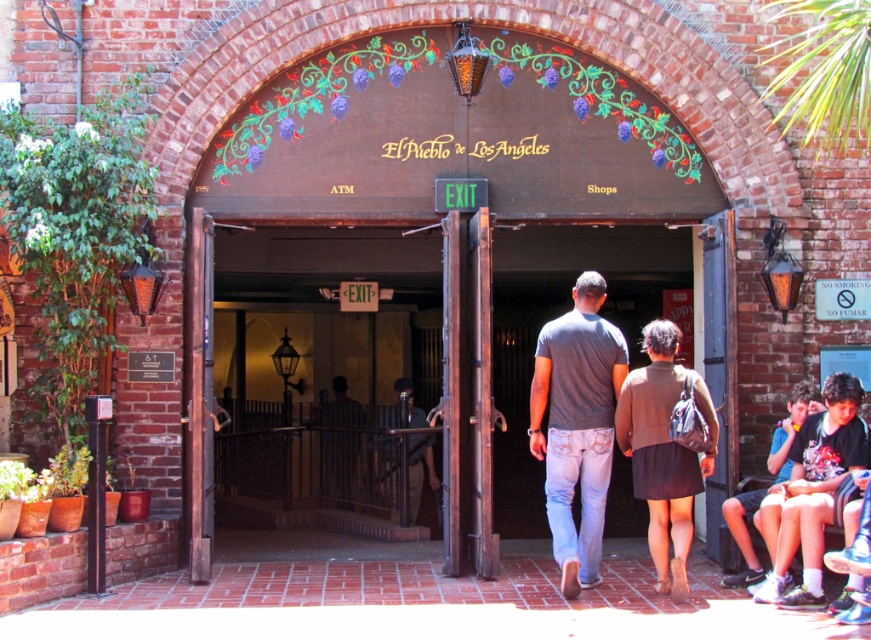
Can you confirm if dark brown sweater at center is positioned to the right of blue denim shorts at lower right?

No, dark brown sweater at center is not to the right of blue denim shorts at lower right.

Which is behind, point (636, 396) or point (728, 513)?

The point (728, 513) is more distant.

Between point (691, 481) and point (750, 497), which one is positioned in front?

Point (691, 481)

Where is `dark brown sweater at center`? The width and height of the screenshot is (871, 640). dark brown sweater at center is located at coordinates (663, 451).

Is wooden door at center thinner than blue denim shorts at lower right?

Indeed, wooden door at center has a lesser width compared to blue denim shorts at lower right.

Find the location of a particular element. The width and height of the screenshot is (871, 640). wooden door at center is located at coordinates (291, 476).

Is point (396, 468) less distant than point (740, 502)?

No, it is not.

Where is `wooden door at center`? The width and height of the screenshot is (871, 640). wooden door at center is located at coordinates (291, 476).

Who is taller, gray cotton t-shirt at center or dark brown sweater at center?

Standing taller between the two is gray cotton t-shirt at center.

Locate an element on the screen. The height and width of the screenshot is (640, 871). gray cotton t-shirt at center is located at coordinates (577, 426).